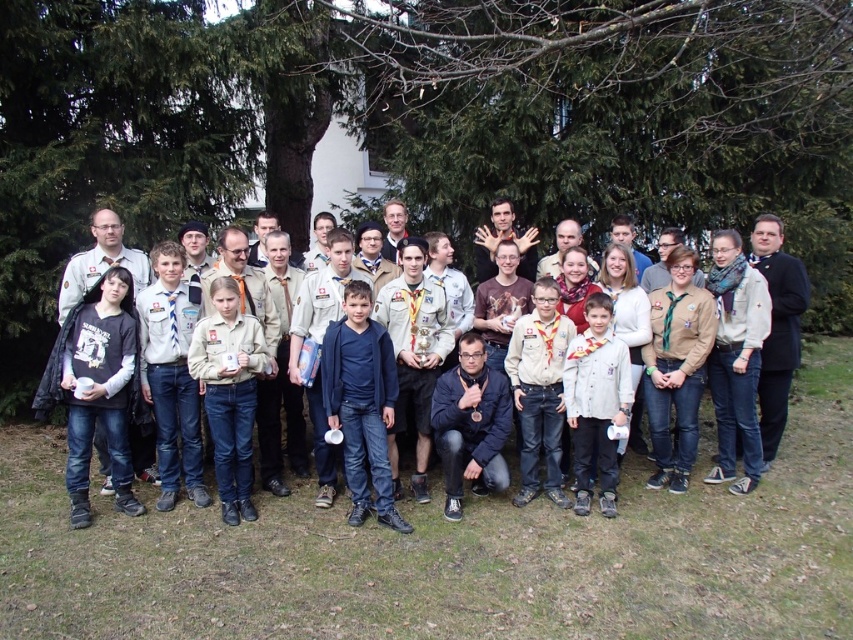
Question: Is matte khaki uniform at center below light brown uniform at center?

Choices:
 (A) yes
 (B) no

Answer: (B)

Question: Is matte khaki uniform at center further to the viewer compared to light brown uniform at center?

Choices:
 (A) no
 (B) yes

Answer: (A)

Question: Among these objects, which one is farthest from the camera?

Choices:
 (A) denim jeans at center
 (B) light brown uniform at center

Answer: (A)

Question: Which object is farther from the camera taking this photo?

Choices:
 (A) khaki uniform at center
 (B) light brown uniform at center
 (C) denim jeans at center

Answer: (A)

Question: Which point appears farthest from the camera in this image?

Choices:
 (A) (524, 316)
 (B) (252, 321)
 (C) (579, 472)

Answer: (A)

Question: Does khaki uniform at center have a smaller size compared to light brown uniform at center?

Choices:
 (A) yes
 (B) no

Answer: (A)